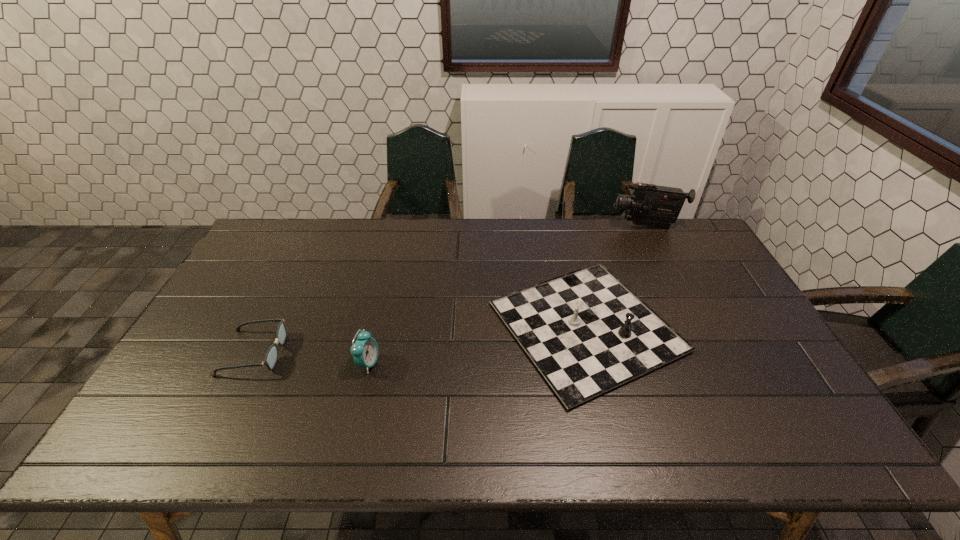
Find the location of a particular element. This screenshot has width=960, height=540. free point between the gameboard and the camcorder is located at coordinates (616, 276).

Find the location of a particular element. The width and height of the screenshot is (960, 540). the closest object to the tallest object is located at coordinates (587, 333).

Locate which object ranks third in proximity to the alarm clock. Please provide its 2D coordinates. Your answer should be formatted as a tuple, i.e. [(x, y)], where the tuple contains the x and y coordinates of a point satisfying the conditions above.

[(649, 205)]

The width and height of the screenshot is (960, 540). I want to click on blank area in the image that satisfies the following two spatial constraints: 1. on the front side of the second shortest object; 2. on the face of the leftmost object, so click(x=592, y=352).